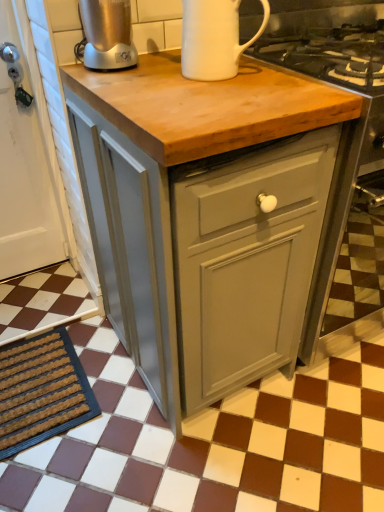
You are a GUI agent. You are given a task and a screenshot of the screen. Output one action in this format:
    pyautogui.click(x=<x>, y=<y>)
    Task: Click on the free location to the right of brown textured mat at lower left
    This screenshot has height=512, width=384.
    Given the screenshot: What is the action you would take?
    pyautogui.click(x=134, y=429)